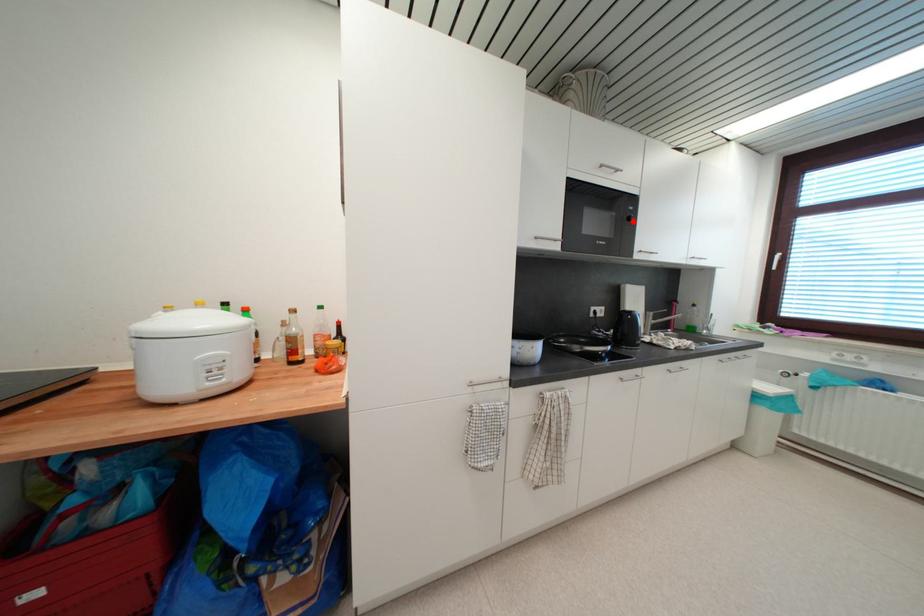
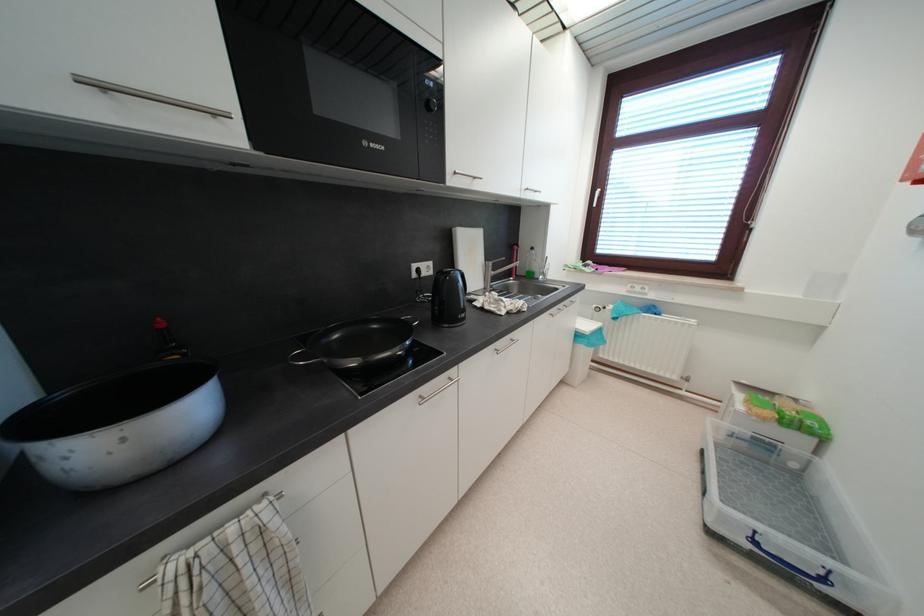
Locate, in the second image, the point that corresponds to the highlighted location in the first image.

(433, 108)